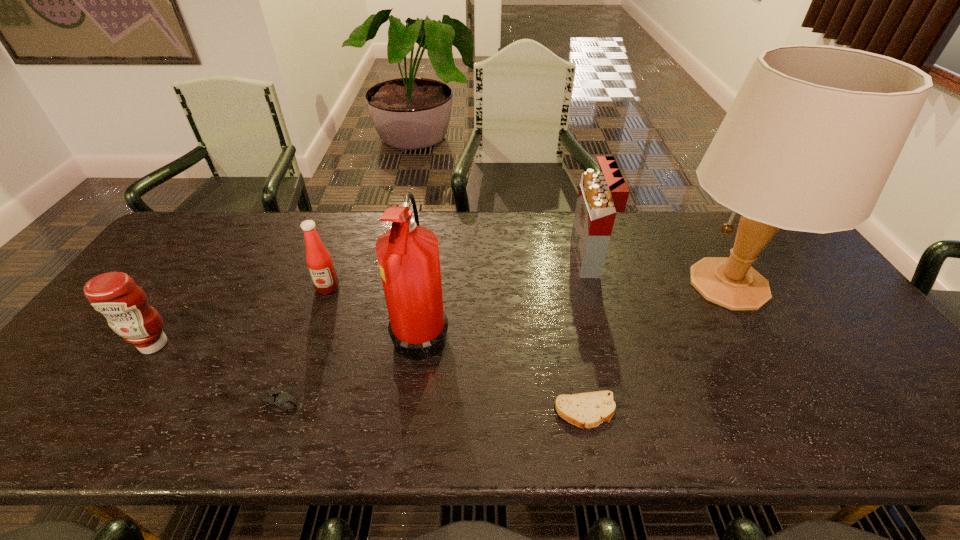
Locate an element on the screen. the tallest object is located at coordinates (810, 140).

Where is `the rightmost object`? This screenshot has width=960, height=540. the rightmost object is located at coordinates (810, 140).

Find the location of a particular element. Image resolution: width=960 pixels, height=540 pixels. fire extinguisher is located at coordinates (408, 254).

Where is `the second tallest object`? This screenshot has width=960, height=540. the second tallest object is located at coordinates (408, 254).

Find the location of `cigarette case`. cigarette case is located at coordinates (601, 195).

Where is `the farther condiment`? The height and width of the screenshot is (540, 960). the farther condiment is located at coordinates (318, 259).

Locate an element on the screen. This screenshot has width=960, height=540. the left condiment is located at coordinates (124, 304).

I want to click on the leftmost object, so point(124,304).

The width and height of the screenshot is (960, 540). I want to click on the second shortest object, so click(x=280, y=401).

Locate an element on the screen. the shortest object is located at coordinates (587, 410).